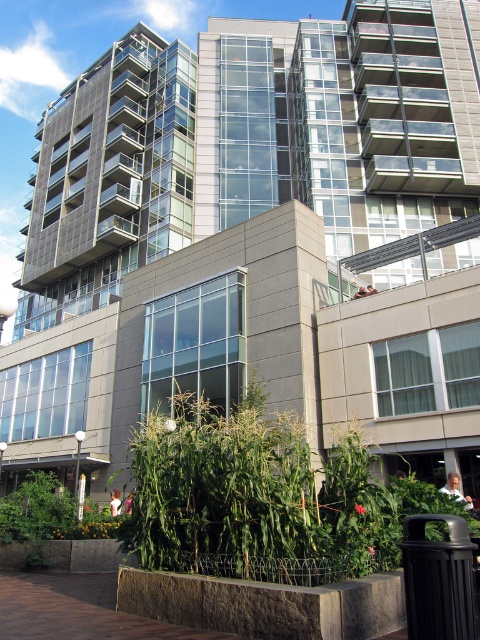
Measure the distance between point [377,490] and camera.

Point [377,490] is 11.59 meters from camera.

Is green leafy plant at lower center smaller than green leafy plant at lower left?

Yes, green leafy plant at lower center is smaller than green leafy plant at lower left.

Locate an element on the screen. This screenshot has width=480, height=640. green leafy plant at lower center is located at coordinates (262, 497).